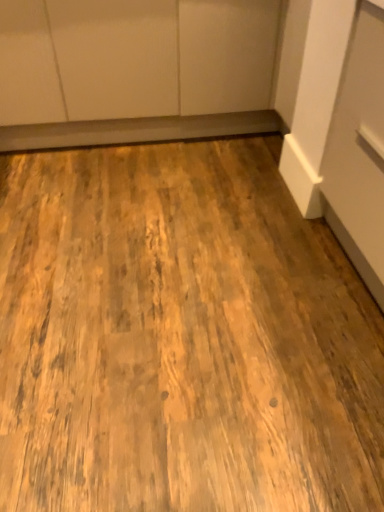
Where is `vacant space situated above natural wood floor at center (from a real-world perspective)`? The image size is (384, 512). vacant space situated above natural wood floor at center (from a real-world perspective) is located at coordinates (173, 259).